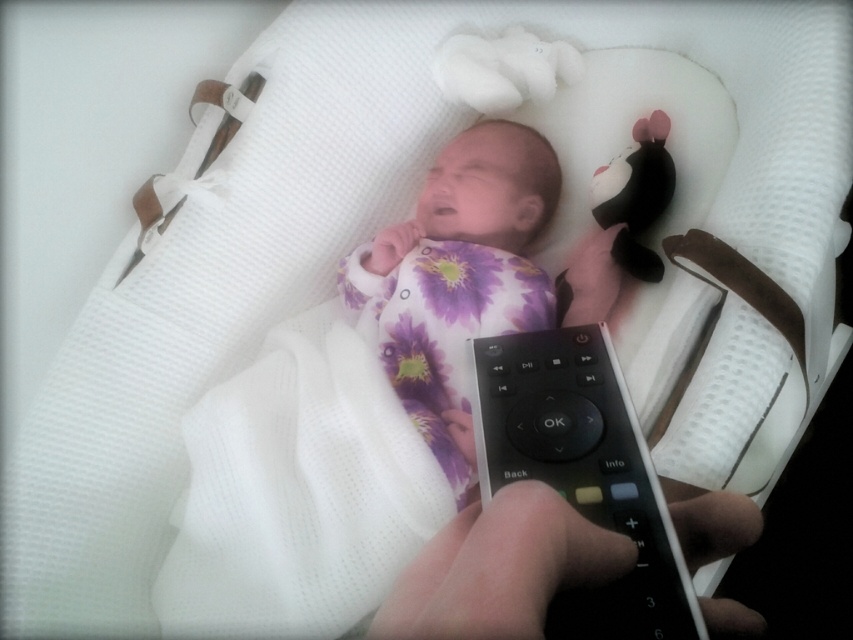
Is purple floral fabric newborn at center taller than black plastic remote at center?

Correct, purple floral fabric newborn at center is much taller as black plastic remote at center.

Is the position of purple floral fabric newborn at center less distant than that of black plastic remote at center?

No, purple floral fabric newborn at center is behind black plastic remote at center.

Does point (598, 296) come closer to viewer compared to point (676, 592)?

That is False.

Image resolution: width=853 pixels, height=640 pixels. I want to click on purple floral fabric newborn at center, so click(469, 278).

Is black plastic remote at center positioned at the back of black matte remote control at center?

Yes, it is.

Does point (555, 483) lie behind point (520, 540)?

Yes.

Who is more distant from viewer, (654, 579) or (740, 621)?

Positioned behind is point (654, 579).

This screenshot has height=640, width=853. I want to click on black plastic remote at center, so click(582, 472).

Who is shorter, purple floral fabric newborn at center or black matte remote control at center?

Standing shorter between the two is black matte remote control at center.

Consider the image. Can you confirm if purple floral fabric newborn at center is positioned to the left of black matte remote control at center?

Indeed, purple floral fabric newborn at center is positioned on the left side of black matte remote control at center.

Between point (498, 193) and point (596, 552), which one is positioned behind?

The point (498, 193) is more distant.

You are a GUI agent. You are given a task and a screenshot of the screen. Output one action in this format:
    pyautogui.click(x=<x>, y=<y>)
    Task: Click on the purple floral fabric newborn at center
    The height and width of the screenshot is (640, 853).
    Given the screenshot: What is the action you would take?
    pyautogui.click(x=469, y=278)